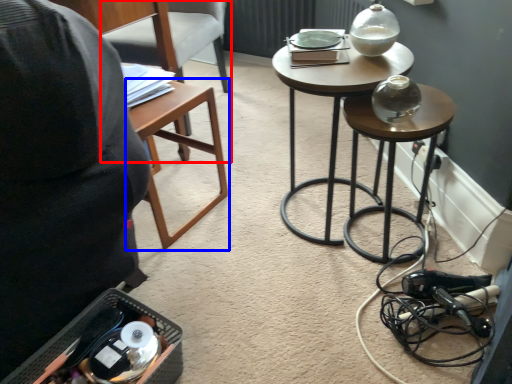
Question: Which object is further to the camera taking this photo, chair (highlighted by a red box) or table (highlighted by a blue box)?

Choices:
 (A) chair
 (B) table

Answer: (A)